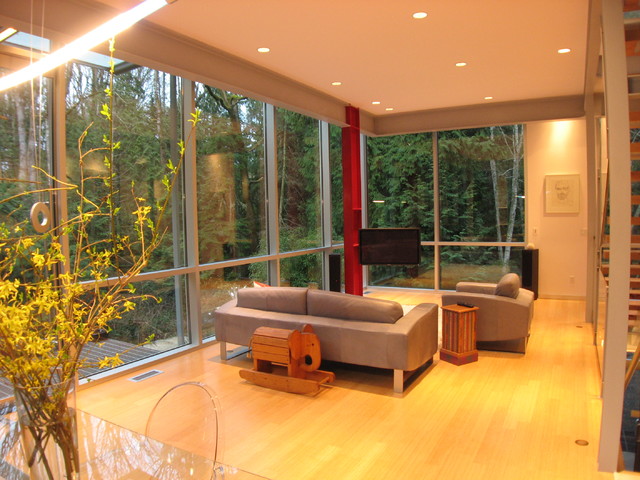
Where is `windows`? This screenshot has width=640, height=480. windows is located at coordinates point(148,161), point(233,140), point(305,164), point(412,164), point(475,194).